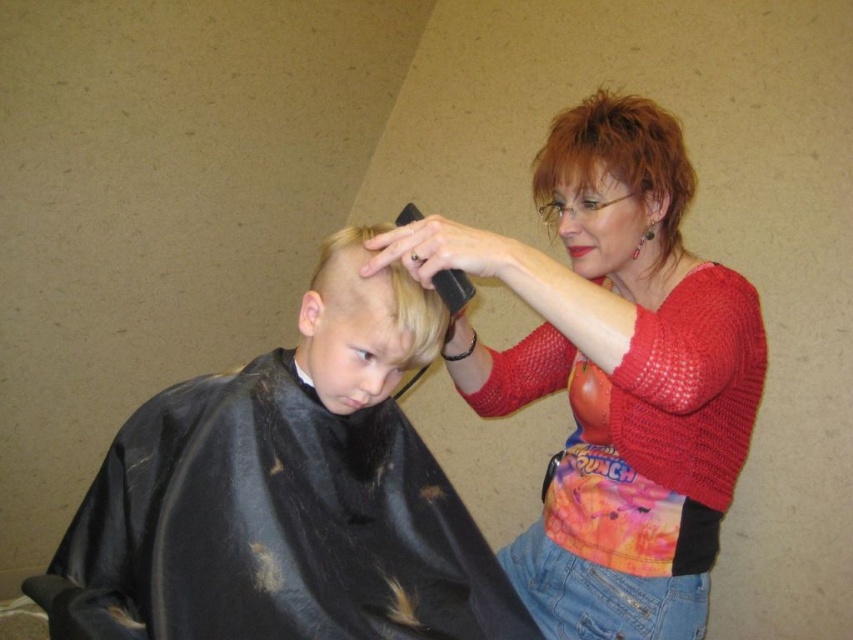
Looking at this image, you are a customer entering the hair salon and see the shiny black cape at lower left and the blonde hair at center. Which object is closer to you as you enter the salon?

The shiny black cape at lower left is closer to you because it is in front of the blonde hair at center.

Based on the scene described, which object has a greater width between the shiny red hair at upper right and the blonde hair at center?

The shiny red hair at upper right has a greater width than the blonde hair at center.